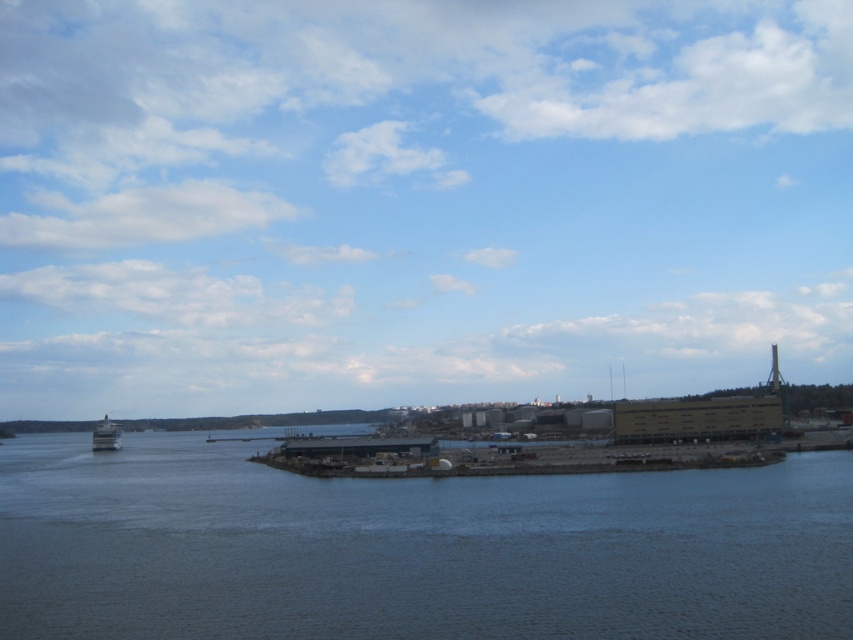
Question: Which object is closer to the camera taking this photo?

Choices:
 (A) metallic gray boat at left
 (B) dark blue water at lower center

Answer: (B)

Question: Can you confirm if dark blue water at lower center is positioned above metallic gray boat at left?

Choices:
 (A) no
 (B) yes

Answer: (B)

Question: Which of the following is the closest to the observer?

Choices:
 (A) (500, 515)
 (B) (97, 444)

Answer: (A)

Question: Considering the relative positions of dark blue water at lower center and metallic gray boat at left in the image provided, where is dark blue water at lower center located with respect to metallic gray boat at left?

Choices:
 (A) right
 (B) left

Answer: (A)

Question: Does dark blue water at lower center appear under metallic gray boat at left?

Choices:
 (A) no
 (B) yes

Answer: (A)

Question: Which of the following is the closest to the observer?

Choices:
 (A) (102, 424)
 (B) (149, 500)

Answer: (B)